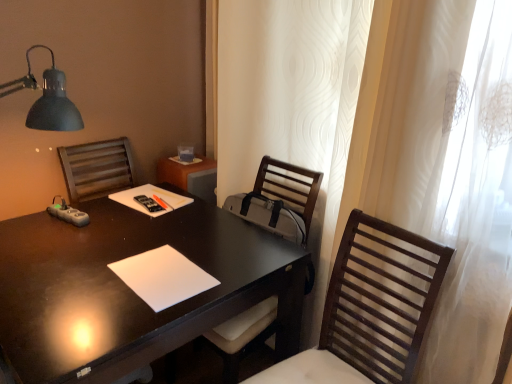
The width and height of the screenshot is (512, 384). Find the location of `space that is in front of black plastic remote control at center`. space that is in front of black plastic remote control at center is located at coordinates (143, 221).